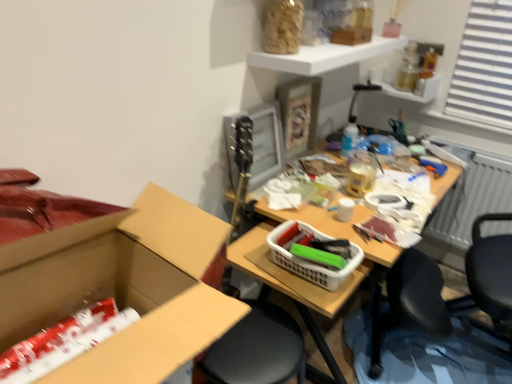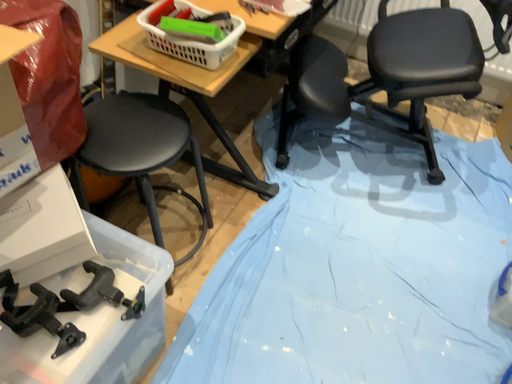
Question: How did the camera likely rotate when shooting the video?

Choices:
 (A) rotated upward
 (B) rotated downward

Answer: (B)